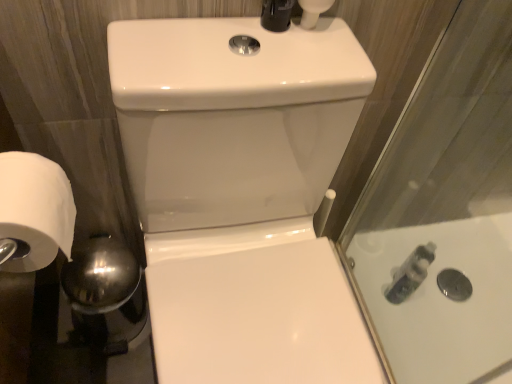
At what (x,y) coordinates should I click in order to perform the action: click on free spot in front of translucent plastic bottle at right. Please return your answer as a coordinate pair (x, y). The height and width of the screenshot is (384, 512). Looking at the image, I should click on (408, 337).